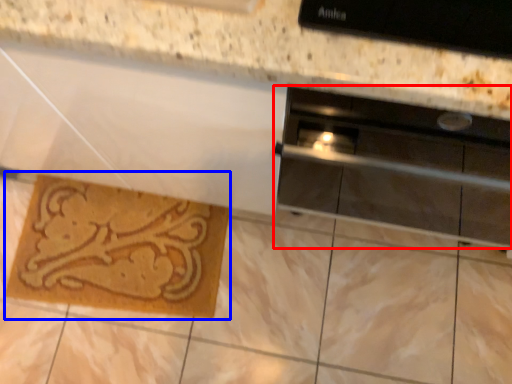
Question: Among these objects, which one is farthest to the camera, home appliance (highlighted by a red box) or doormat (highlighted by a blue box)?

Choices:
 (A) home appliance
 (B) doormat

Answer: (B)